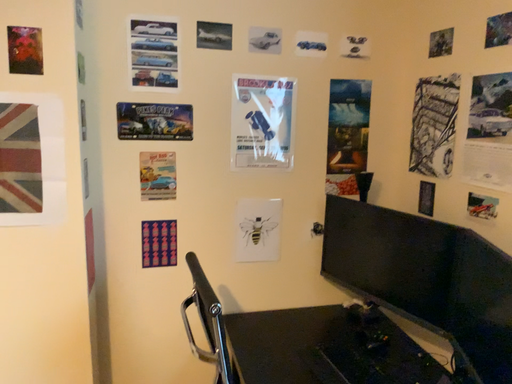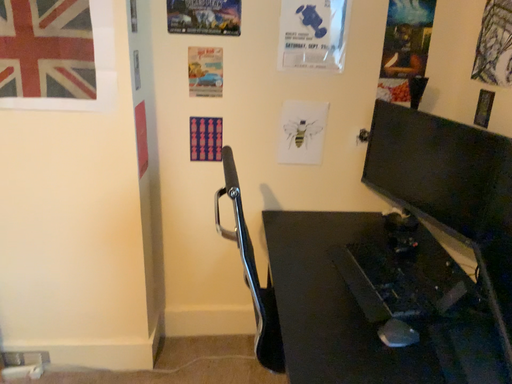
Question: How did the camera likely rotate when shooting the video?

Choices:
 (A) rotated left
 (B) rotated right

Answer: (A)